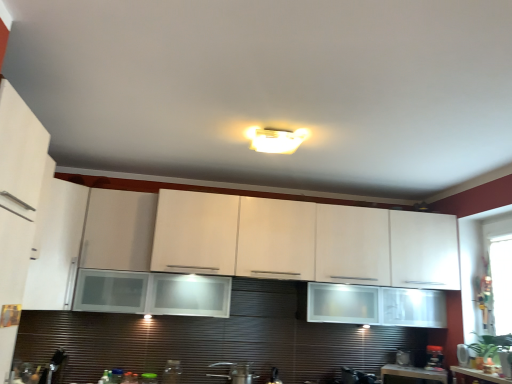
Question: Can you confirm if white matte cabinet at left, which ranks as the first cabinetry in left-to-right order, is thinner than green plastic lid at lower center, the first appliance when ordered from left to right?

Choices:
 (A) yes
 (B) no

Answer: (B)

Question: Is white matte cabinet at left, marked as the 2th cabinetry in a right-to-left arrangement, not close to green plastic lid at lower center, the 7th appliance from the right?

Choices:
 (A) yes
 (B) no

Answer: (A)

Question: Is white matte cabinet at left, which ranks as the first cabinetry in left-to-right order, further to camera compared to green plastic lid at lower center, the 7th appliance from the right?

Choices:
 (A) no
 (B) yes

Answer: (A)

Question: From a real-world perspective, is white matte cabinet at left, marked as the 2th cabinetry in a right-to-left arrangement, physically above green plastic lid at lower center, the first appliance when ordered from left to right?

Choices:
 (A) no
 (B) yes

Answer: (B)

Question: Is white matte cabinet at left, which ranks as the first cabinetry in left-to-right order, to the right of green plastic lid at lower center, the 7th appliance from the right, from the viewer's perspective?

Choices:
 (A) no
 (B) yes

Answer: (A)

Question: From a real-world perspective, relative to white glossy microwave at upper right, which ranks as the first appliance in right-to-left order, is white glossy cabinet at upper center, which appears as the first cabinetry when viewed from the right, vertically above or below?

Choices:
 (A) below
 (B) above

Answer: (B)

Question: Relative to white glossy microwave at upper right, which ranks as the first appliance in right-to-left order, is white glossy cabinet at upper center, which appears as the first cabinetry when viewed from the right, in front or behind?

Choices:
 (A) front
 (B) behind

Answer: (A)

Question: Considering the positions of white glossy cabinet at upper center, which appears as the first cabinetry when viewed from the right, and white glossy microwave at upper right, which ranks as the first appliance in right-to-left order, in the image, is white glossy cabinet at upper center, which appears as the first cabinetry when viewed from the right, bigger or smaller than white glossy microwave at upper right, which ranks as the first appliance in right-to-left order,?

Choices:
 (A) big
 (B) small

Answer: (A)

Question: From the image's perspective, is white glossy cabinet at upper center, which appears as the first cabinetry when viewed from the right, positioned above or below white glossy microwave at upper right, which ranks as the first appliance in right-to-left order?

Choices:
 (A) above
 (B) below

Answer: (A)

Question: Considering the positions of black plastic coffee maker at lower right, placed as the sixth appliance when sorted from left to right, and black glossy coffee maker at lower center, acting as the 4th appliance starting from the right, in the image, is black plastic coffee maker at lower right, placed as the sixth appliance when sorted from left to right, wider or thinner than black glossy coffee maker at lower center, acting as the 4th appliance starting from the right,?

Choices:
 (A) wide
 (B) thin

Answer: (B)

Question: From the image's perspective, is black plastic coffee maker at lower right, placed as the sixth appliance when sorted from left to right, located above or below black glossy coffee maker at lower center, the fourth appliance positioned from the left?

Choices:
 (A) above
 (B) below

Answer: (A)

Question: From their relative heights in the image, would you say black plastic coffee maker at lower right, the second appliance when ordered from right to left, is taller or shorter than black glossy coffee maker at lower center, acting as the 4th appliance starting from the right?

Choices:
 (A) tall
 (B) short

Answer: (A)

Question: Which is correct: black plastic coffee maker at lower right, placed as the sixth appliance when sorted from left to right, is inside black glossy coffee maker at lower center, acting as the 4th appliance starting from the right, or outside of it?

Choices:
 (A) outside
 (B) inside

Answer: (A)

Question: Is white glossy countertop at lower right in front of or behind transparent glass window screen at right in the image?

Choices:
 (A) front
 (B) behind

Answer: (A)

Question: From a real-world perspective, relative to transparent glass window screen at right, is white glossy countertop at lower right vertically above or below?

Choices:
 (A) below
 (B) above

Answer: (A)